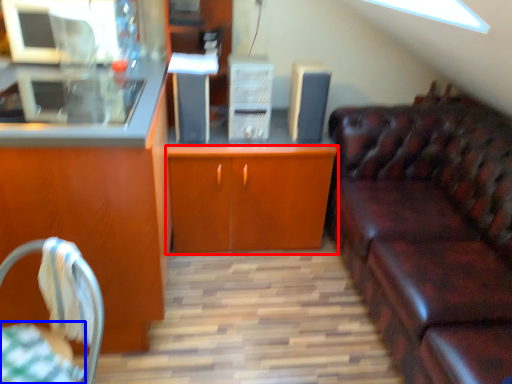
Question: Which object is closer to the camera taking this photo, cabinetry (highlighted by a red box) or tablecloth (highlighted by a blue box)?

Choices:
 (A) cabinetry
 (B) tablecloth

Answer: (B)